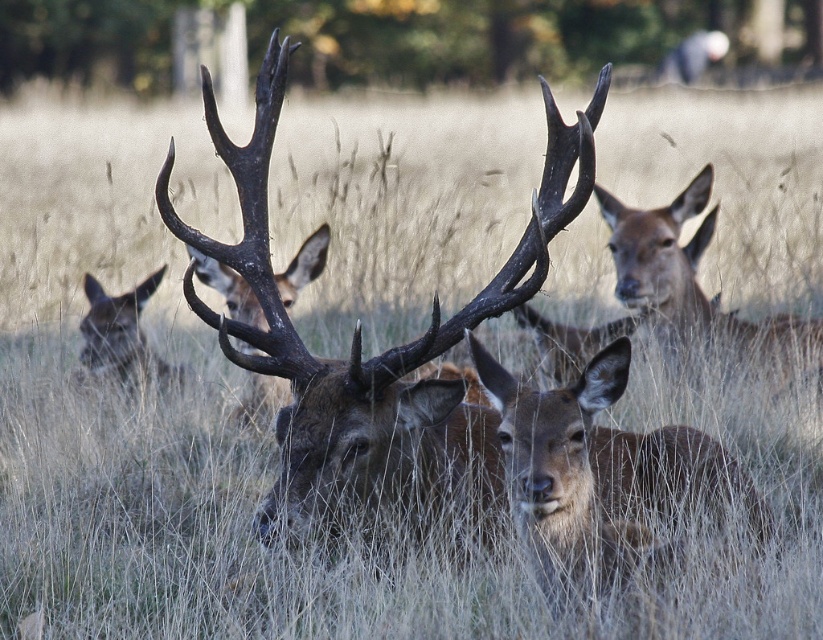
Is brown matte/deer at center positioned before brown matte/deer at upper center?

Yes, brown matte/deer at center is closer to the viewer.

Locate an element on the screen. Image resolution: width=823 pixels, height=640 pixels. brown matte/deer at center is located at coordinates (565, 477).

Consider the image. Which of these two, brown textured fur at center or brown matte/deer at upper center, stands taller?

brown textured fur at center is taller.

Does brown textured fur at center appear on the right side of brown matte/deer at upper center?

No, brown textured fur at center is not to the right of brown matte/deer at upper center.

In order to click on brown textured fur at center in this screenshot , I will do `click(374, 356)`.

Can you confirm if brown textured fur at center is positioned to the left of brown matte/deer at center?

Yes, brown textured fur at center is to the left of brown matte/deer at center.

Is brown textured fur at center wider than brown matte/deer at center?

Yes.

Is point (214, 314) more distant than point (533, 412)?

Yes.

This screenshot has width=823, height=640. Find the location of `brown textured fur at center`. brown textured fur at center is located at coordinates (374, 356).